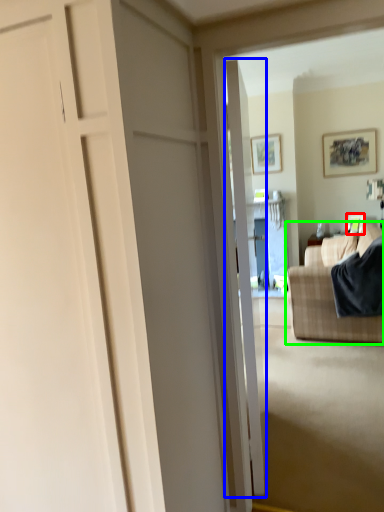
Question: Which object is positioned closest to picture frame (highlighted by a red box)? Select from door (highlighted by a blue box) and studio couch (highlighted by a green box).

Choices:
 (A) door
 (B) studio couch

Answer: (B)